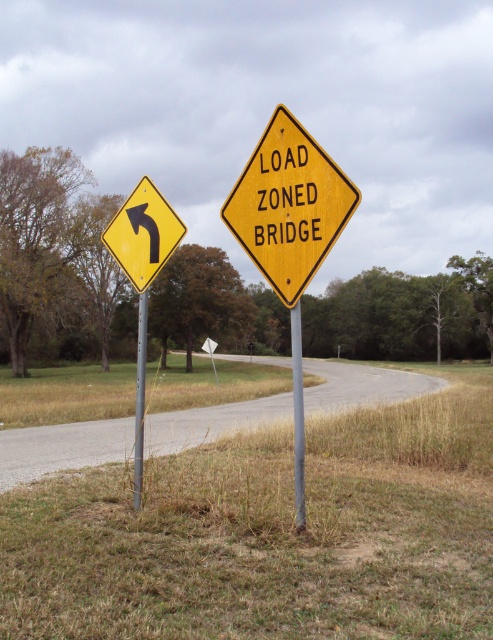
You are standing at point point at (305, 161). The camera is 5.40 meters away from you. If you walk straight towards the camera, will you be able to see the road signs on the metal poles before reaching the camera?

Yes, because the point at (305, 161) is 5.40 meters away from the camera, so walking straight towards the camera would bring you closer to the road signs on the metal poles, making them visible before reaching the camera.

You are a delivery truck driver approaching the curved road. Your truck is 16 feet long. You see the metallic gray pole at center ahead. Can your truck pass between the pole and the road curve without hitting it?

The metallic gray pole at center is 17.49 feet away from the camera. Since your truck is 16 feet long, it can safely pass between the pole and the road curve without hitting it as there is enough space.

You are driving a truck and need to pass through the area shown in the image. There are two road signs on poles. Based on their positions, which pole is closer to you, the metallic gray pole at center or the metallic pole at left?

The metallic gray pole at center is in front of the metallic pole at left, so it is closer to you.